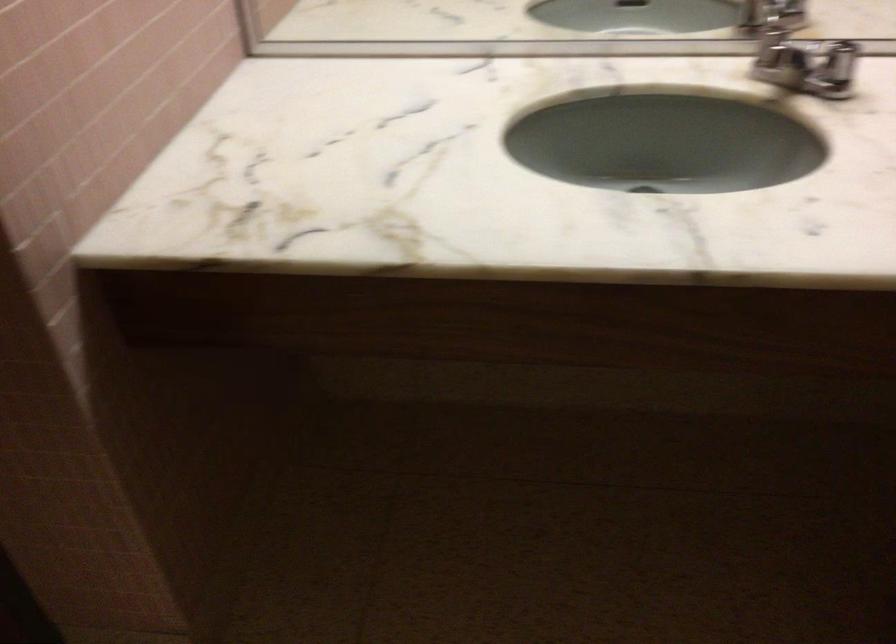
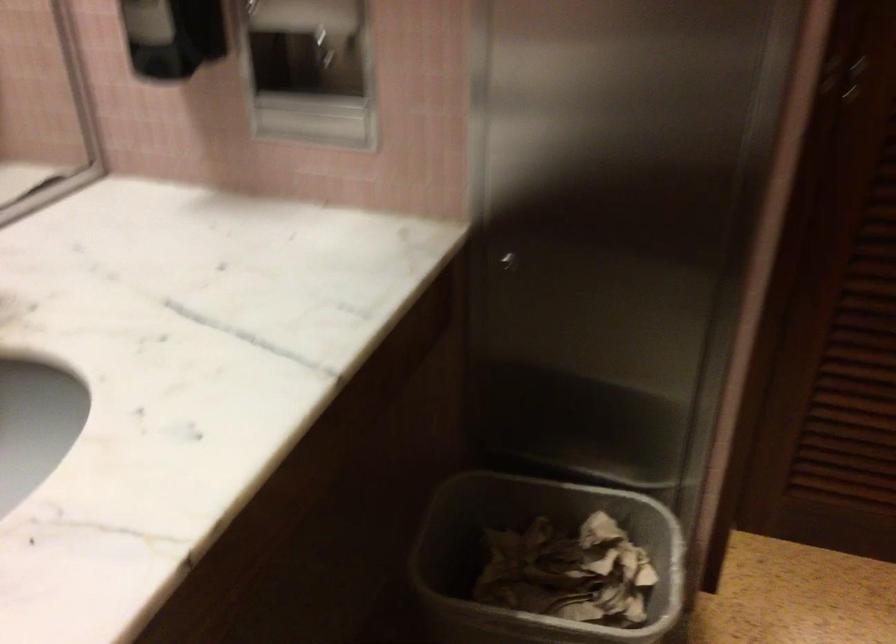
Question: The camera is either moving clockwise (left) or counter-clockwise (right) around the object. The first image is from the beginning of the video and the second image is from the end. Is the camera moving left or right when shooting the video?

Choices:
 (A) Left
 (B) Right

Answer: (A)